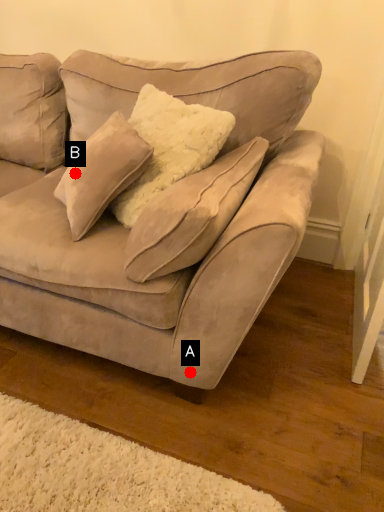
Question: Two points are circled on the image, labeled by A and B beside each circle. Among these points, which one is nearest to the camera?

Choices:
 (A) A is closer
 (B) B is closer

Answer: (A)